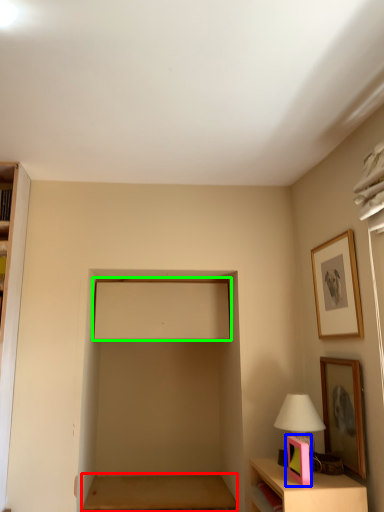
Question: Which object is positioned farthest from table (highlighted by a red box)? Select from picture frame (highlighted by a blue box) and window screen (highlighted by a green box).

Choices:
 (A) picture frame
 (B) window screen

Answer: (A)